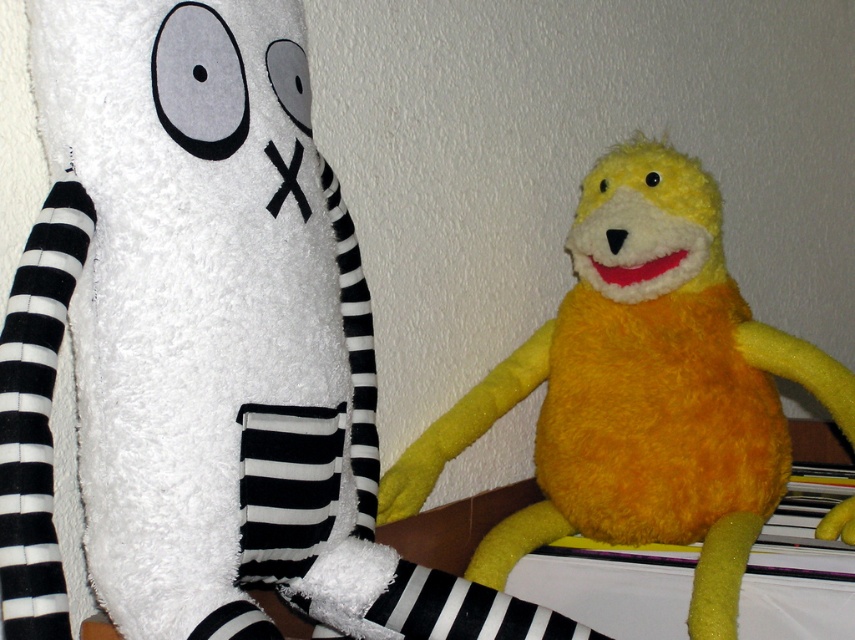
Question: Which object appears closest to the camera in this image?

Choices:
 (A) yellow plush toy at right
 (B) yellow fuzzy stuffed animal at center

Answer: (A)

Question: Is yellow plush toy at right to the right of yellow fuzzy stuffed animal at center from the viewer's perspective?

Choices:
 (A) yes
 (B) no

Answer: (B)

Question: Can you confirm if yellow plush toy at right is wider than yellow fuzzy stuffed animal at center?

Choices:
 (A) no
 (B) yes

Answer: (A)

Question: Is yellow plush toy at right positioned in front of yellow fuzzy stuffed animal at center?

Choices:
 (A) yes
 (B) no

Answer: (A)